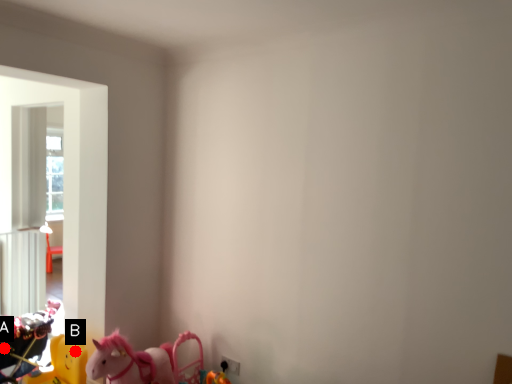
Question: Two points are circled on the image, labeled by A and B beside each circle. Which point is farther to the camera?

Choices:
 (A) A is further
 (B) B is further

Answer: (A)